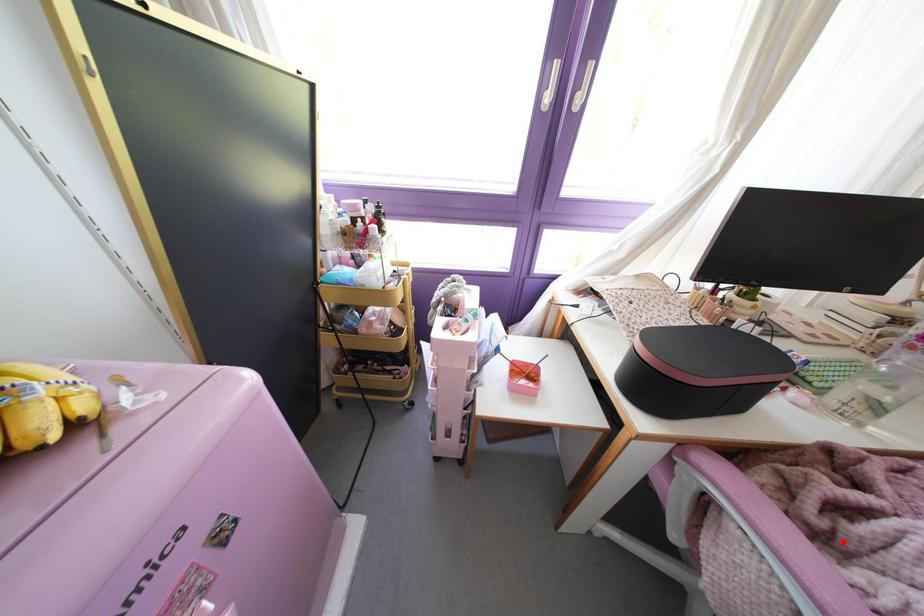
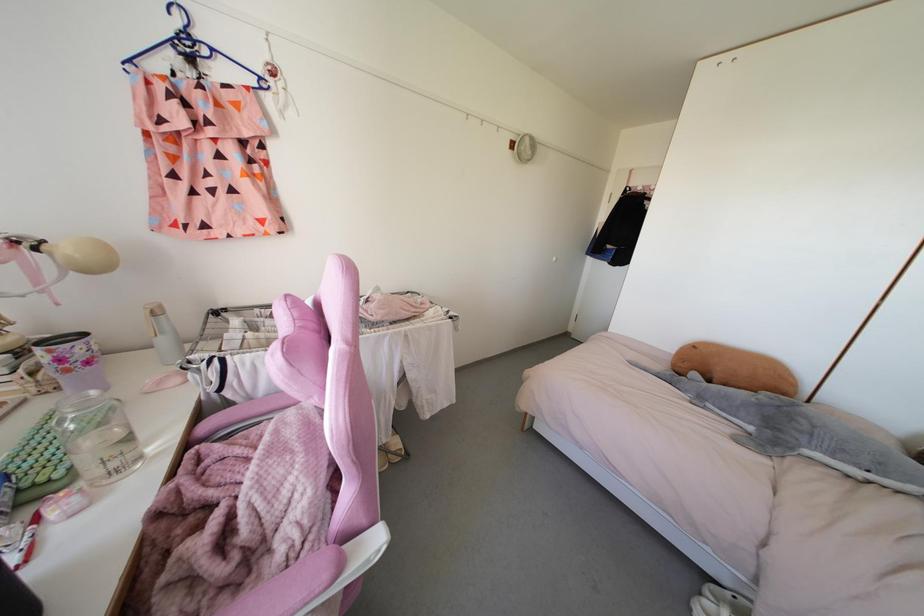
Find the pixel in the second image that matches the highlighted location in the first image.

(252, 543)